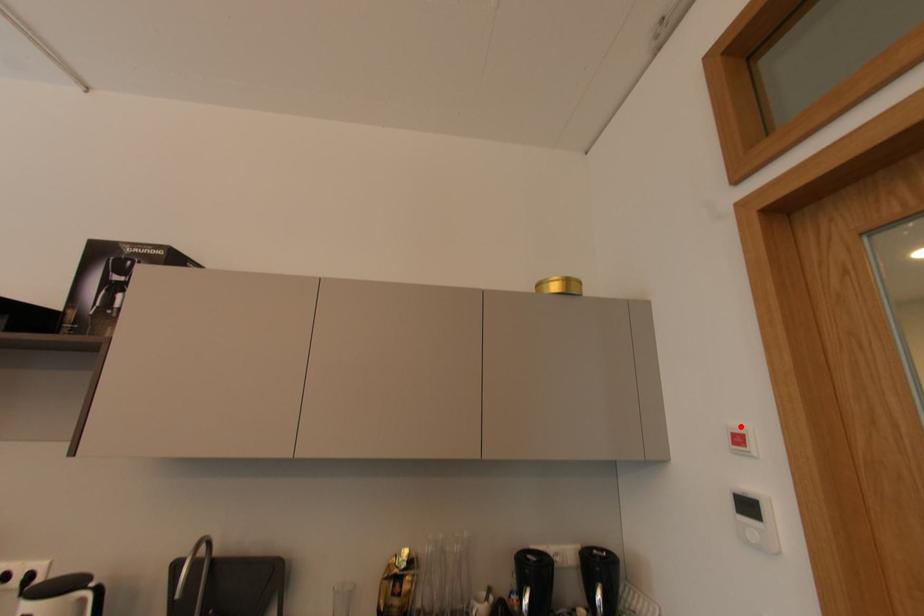
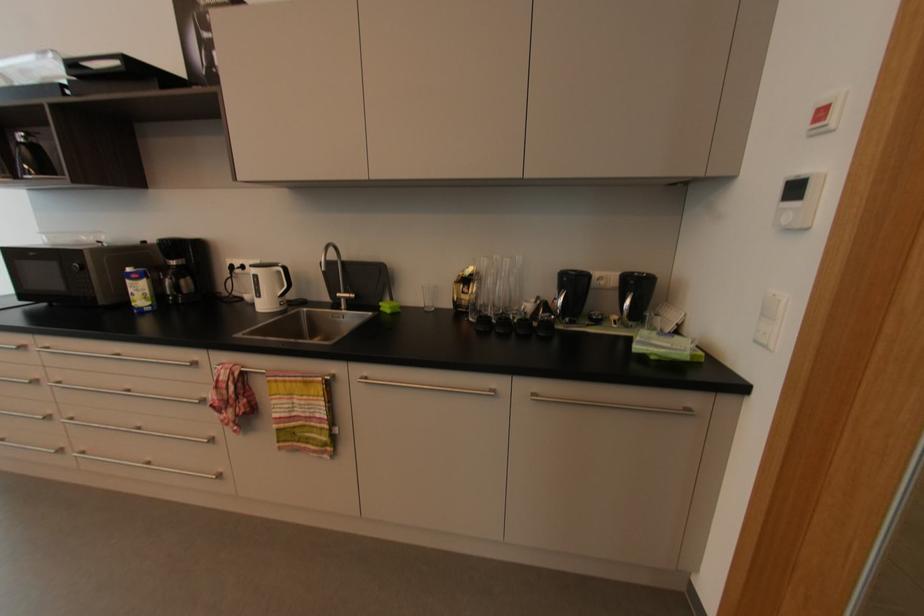
The point at the highlighted location is marked in the first image. Where is the corresponding point in the second image?

(832, 99)